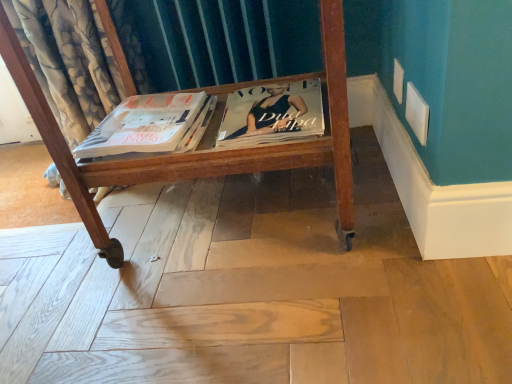
Question: From the image's perspective, is matte white magazine at center located above matte black magazine at center?

Choices:
 (A) no
 (B) yes

Answer: (A)

Question: Considering the relative sizes of matte white magazine at center and matte black magazine at center in the image provided, is matte white magazine at center shorter than matte black magazine at center?

Choices:
 (A) no
 (B) yes

Answer: (B)

Question: Is matte white magazine at center aimed at matte black magazine at center?

Choices:
 (A) no
 (B) yes

Answer: (A)

Question: Does matte white magazine at center come behind matte black magazine at center?

Choices:
 (A) no
 (B) yes

Answer: (B)

Question: Is matte black magazine at center located within matte white magazine at center?

Choices:
 (A) no
 (B) yes

Answer: (A)

Question: Is point (99, 125) closer or farther from the camera than point (266, 112)?

Choices:
 (A) closer
 (B) farther

Answer: (B)

Question: Considering the positions of matte white magazine at center and matte black magazine at center in the image, is matte white magazine at center bigger or smaller than matte black magazine at center?

Choices:
 (A) small
 (B) big

Answer: (A)

Question: From the image's perspective, is matte white magazine at center located above or below matte black magazine at center?

Choices:
 (A) above
 (B) below

Answer: (B)

Question: From a real-world perspective, is matte white magazine at center physically located above or below matte black magazine at center?

Choices:
 (A) above
 (B) below

Answer: (A)

Question: Considering the relative positions of wooden cart at center and matte white magazine at center in the image provided, is wooden cart at center to the left or to the right of matte white magazine at center?

Choices:
 (A) right
 (B) left

Answer: (A)

Question: Is wooden cart at center bigger or smaller than matte white magazine at center?

Choices:
 (A) big
 (B) small

Answer: (A)

Question: Choose the correct answer: Is wooden cart at center inside matte white magazine at center or outside it?

Choices:
 (A) inside
 (B) outside

Answer: (B)

Question: Is point (311, 162) closer or farther from the camera than point (179, 104)?

Choices:
 (A) closer
 (B) farther

Answer: (A)

Question: Is wooden cart at center spatially inside matte black magazine at center, or outside of it?

Choices:
 (A) inside
 (B) outside

Answer: (B)

Question: Looking at their shapes, would you say wooden cart at center is wider or thinner than matte black magazine at center?

Choices:
 (A) thin
 (B) wide

Answer: (B)